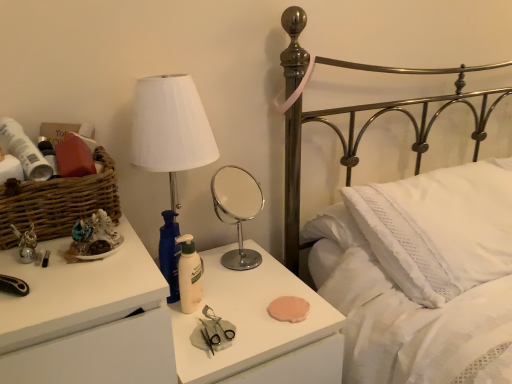
Where is `vacant space in front of chrome/metallic round mirror at center`? vacant space in front of chrome/metallic round mirror at center is located at coordinates (247, 286).